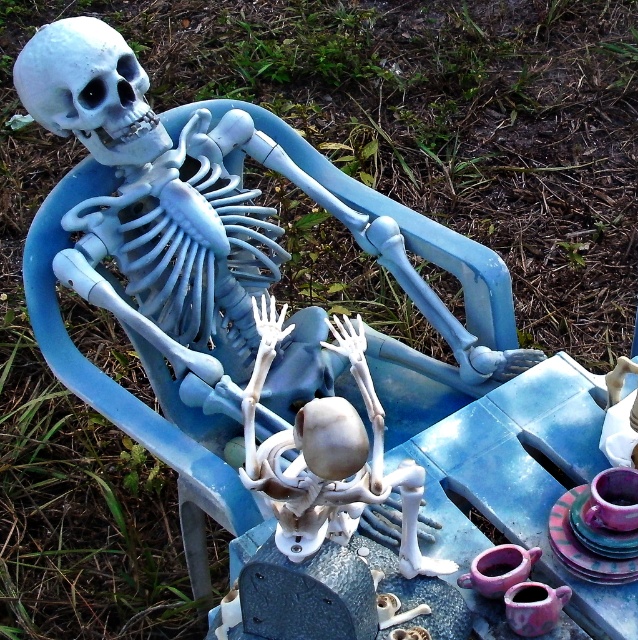
Can you confirm if white matte skeleton at center is positioned below purple glazed cup at lower right?

No, white matte skeleton at center is not below purple glazed cup at lower right.

Does white matte skeleton at center have a greater width compared to purple glazed cup at lower right?

Indeed, white matte skeleton at center has a greater width compared to purple glazed cup at lower right.

Describe the element at coordinates (329, 456) in the screenshot. The width and height of the screenshot is (638, 640). I see `white matte skeleton at center` at that location.

In order to click on white matte skeleton at center in this screenshot , I will do `click(329, 456)`.

Which is in front, point (36, 106) or point (505, 547)?

Positioned in front is point (505, 547).

Between white matte skull at upper left and matte purple cup at lower right, which one appears on the left side from the viewer's perspective?

From the viewer's perspective, white matte skull at upper left appears more on the left side.

The image size is (638, 640). I want to click on white matte skull at upper left, so click(89, 90).

Identify the location of white matte skeleton at center. This screenshot has height=640, width=638. (329, 456).

The image size is (638, 640). Describe the element at coordinates (329, 456) in the screenshot. I see `white matte skeleton at center` at that location.

This screenshot has height=640, width=638. What are the coordinates of `white matte skeleton at center` in the screenshot? It's located at (329, 456).